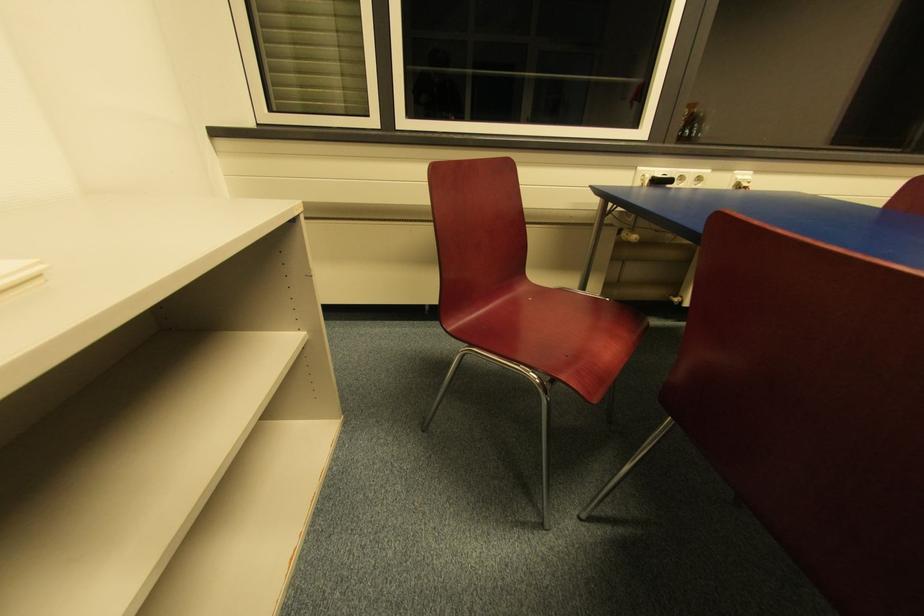
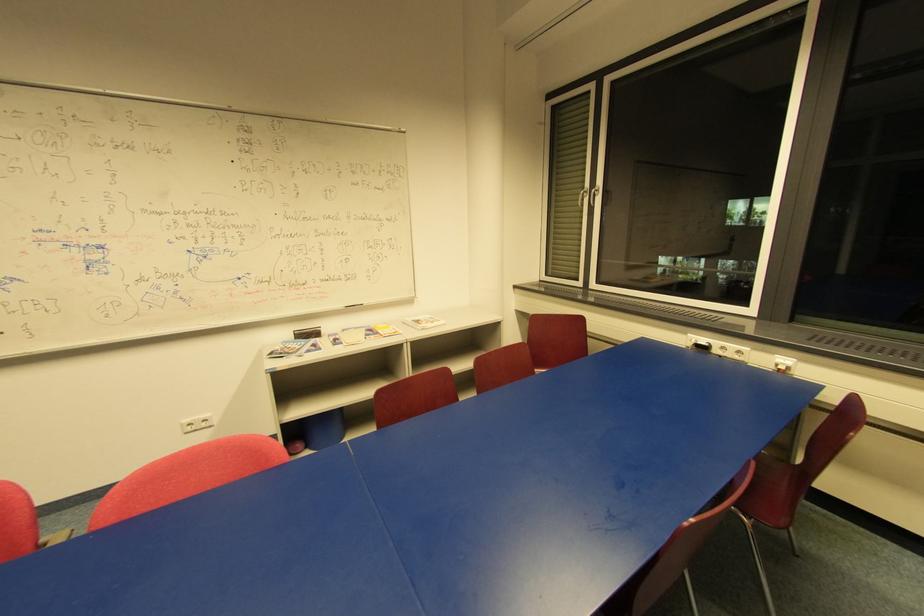
Locate, in the second image, the point that corresponds to (x=748, y=185) in the first image.

(785, 369)